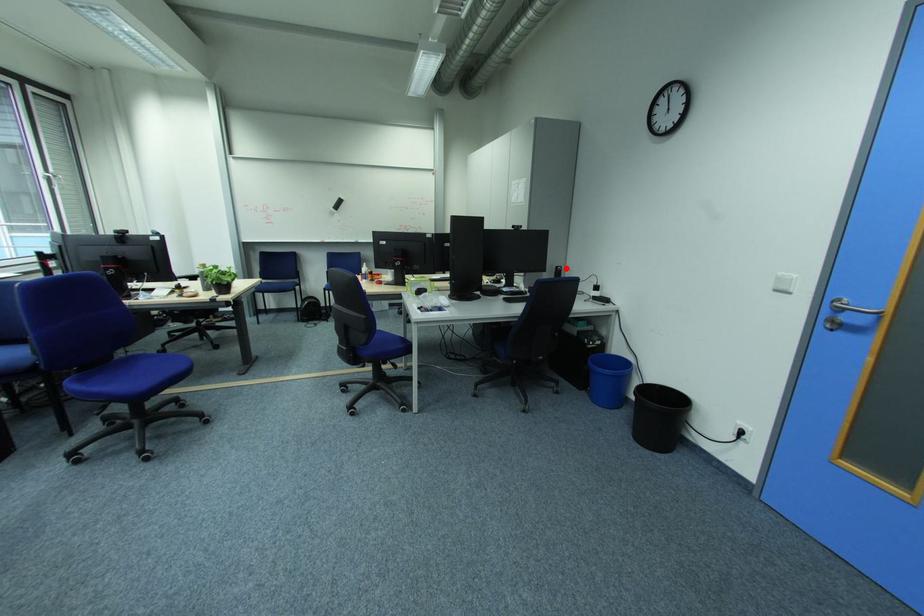
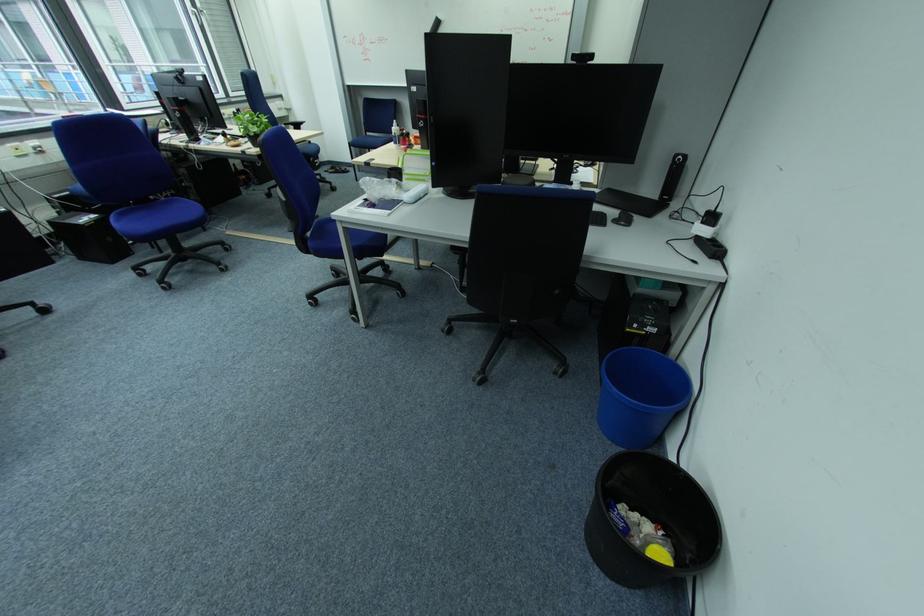
In the second image, find the point that corresponds to the highlighted location in the first image.

(686, 156)